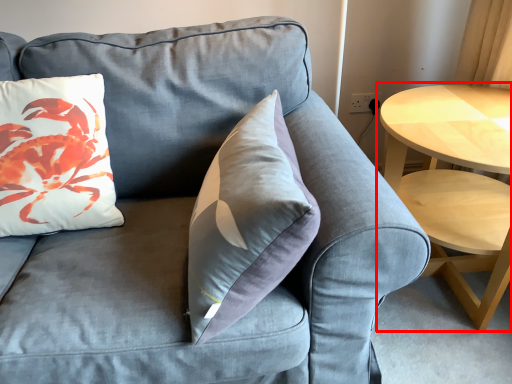
Question: From the image's perspective, considering the relative positions of coffee table (annotated by the red box) and pillow in the image provided, where is coffee table (annotated by the red box) located with respect to the staircase?

Choices:
 (A) below
 (B) above

Answer: (A)